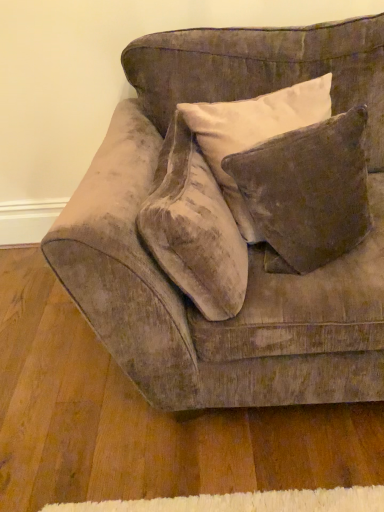
Question: From a real-world perspective, is velvet couch at center above or below velvet brown pillow at upper right?

Choices:
 (A) above
 (B) below

Answer: (B)

Question: Considering the positions of point (241, 397) and point (274, 206), is point (241, 397) closer or farther from the camera than point (274, 206)?

Choices:
 (A) closer
 (B) farther

Answer: (B)

Question: Estimate the real-world distances between objects in this image. Which object is farther from the velvet beige throw pillow at center?

Choices:
 (A) velvet couch at center
 (B) velvet brown pillow at upper right

Answer: (B)

Question: Which object is the farthest from the velvet beige throw pillow at center?

Choices:
 (A) velvet brown pillow at upper right
 (B) velvet couch at center

Answer: (A)